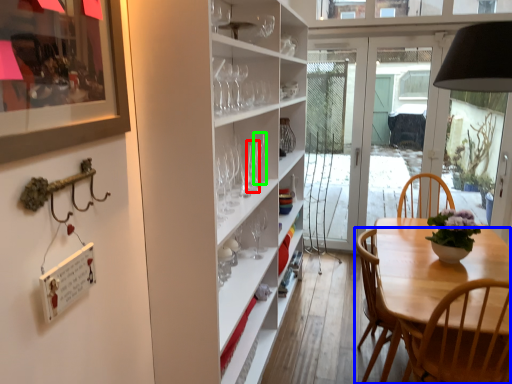
Question: Which object is the closest to the wine glass (highlighted by a red box)? Choose among these: chair (highlighted by a blue box) or wine glass (highlighted by a green box).

Choices:
 (A) chair
 (B) wine glass

Answer: (B)